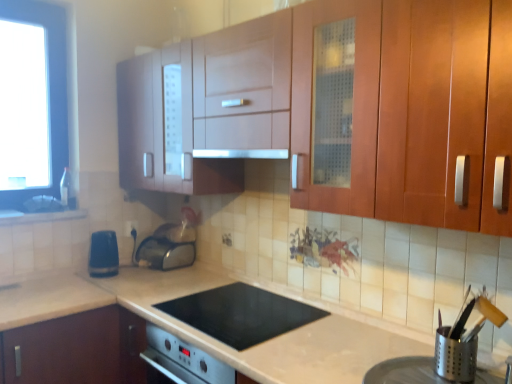
You are a GUI agent. You are given a task and a screenshot of the screen. Output one action in this format:
    pyautogui.click(x=<x>, y=<y>)
    Task: Click on the free space below satin silver exhaust hood at center (from a real-world perspective)
    The height and width of the screenshot is (384, 512).
    Given the screenshot: What is the action you would take?
    pyautogui.click(x=259, y=300)